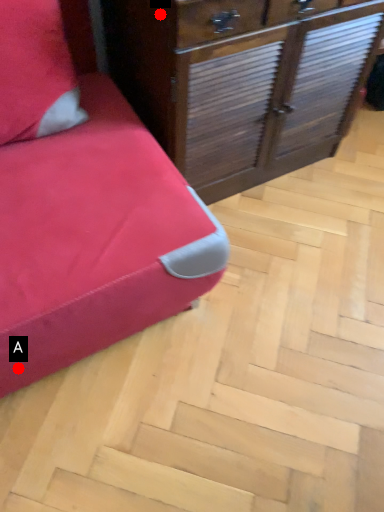
Question: Two points are circled on the image, labeled by A and B beside each circle. Which point is closer to the camera?

Choices:
 (A) A is closer
 (B) B is closer

Answer: (B)